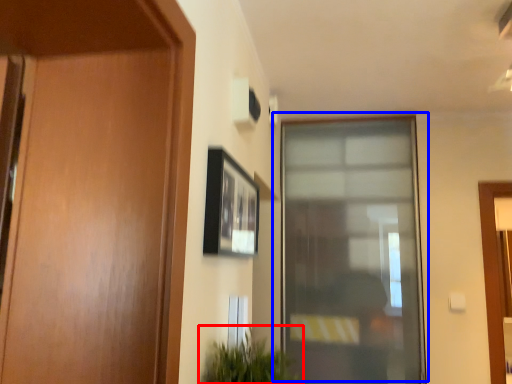
Question: Which object appears farthest to the camera in this image, houseplant (highlighted by a red box) or window (highlighted by a blue box)?

Choices:
 (A) houseplant
 (B) window

Answer: (B)